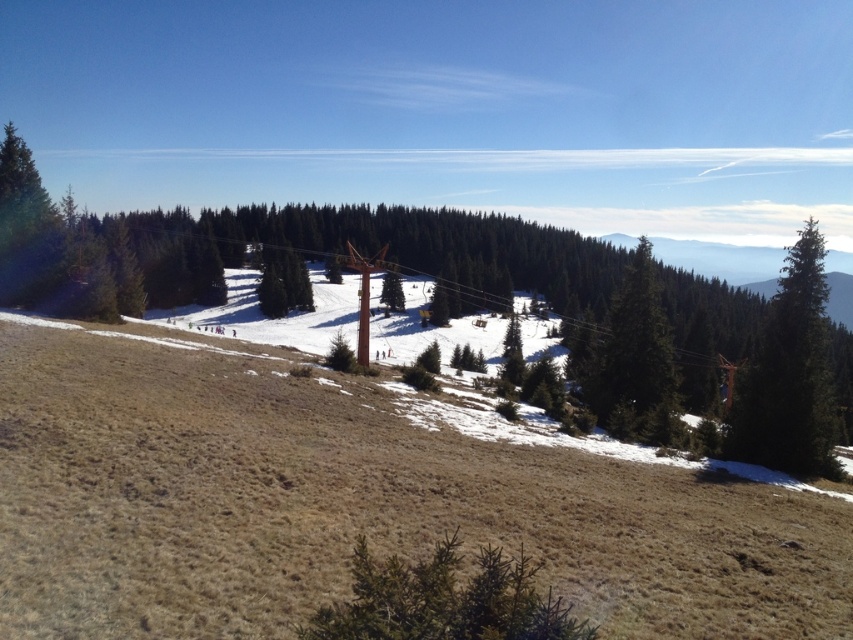
Question: Which point appears closest to the camera in this image?

Choices:
 (A) (395, 276)
 (B) (643, 259)

Answer: (B)

Question: Can you confirm if dark green coniferous tree at right is thinner than green matte tree at center-right?

Choices:
 (A) no
 (B) yes

Answer: (A)

Question: Which point is closer to the camera?

Choices:
 (A) (798, 360)
 (B) (556, 614)

Answer: (B)

Question: Is green matte tree at lower center positioned before dark green coniferous tree at right?

Choices:
 (A) yes
 (B) no

Answer: (A)

Question: Which of the following is the farthest from the observer?

Choices:
 (A) (384, 275)
 (B) (631, 428)
 (C) (788, 296)
 (D) (360, 579)

Answer: (A)

Question: Does green matte tree at lower center have a lesser width compared to green matte tree at center?

Choices:
 (A) no
 (B) yes

Answer: (B)